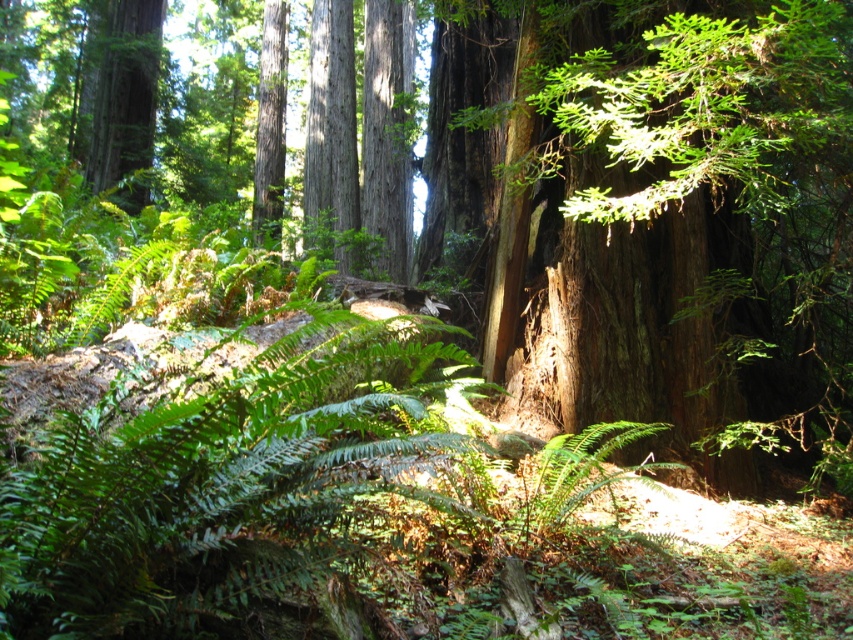
Question: Observing the image, what is the correct spatial positioning of green leafy fern at center in reference to smooth brown tree trunk at center?

Choices:
 (A) above
 (B) below

Answer: (B)

Question: Is green leafy fern at center wider than smooth brown tree trunk at center?

Choices:
 (A) yes
 (B) no

Answer: (B)

Question: Which object is closer to the camera taking this photo?

Choices:
 (A) green leafy fern at center
 (B) smooth brown tree trunk at upper left
 (C) smooth brown tree trunk at center

Answer: (A)

Question: Which point is closer to the camera?

Choices:
 (A) smooth brown tree trunk at upper left
 (B) green leafy fern at center

Answer: (B)

Question: Is smooth brown tree trunk at center bigger than smooth brown tree trunk at upper left?

Choices:
 (A) no
 (B) yes

Answer: (A)

Question: Based on their relative distances, which object is nearer to the green leafy fern at center?

Choices:
 (A) smooth brown tree trunk at upper left
 (B) smooth brown tree trunk at center

Answer: (B)